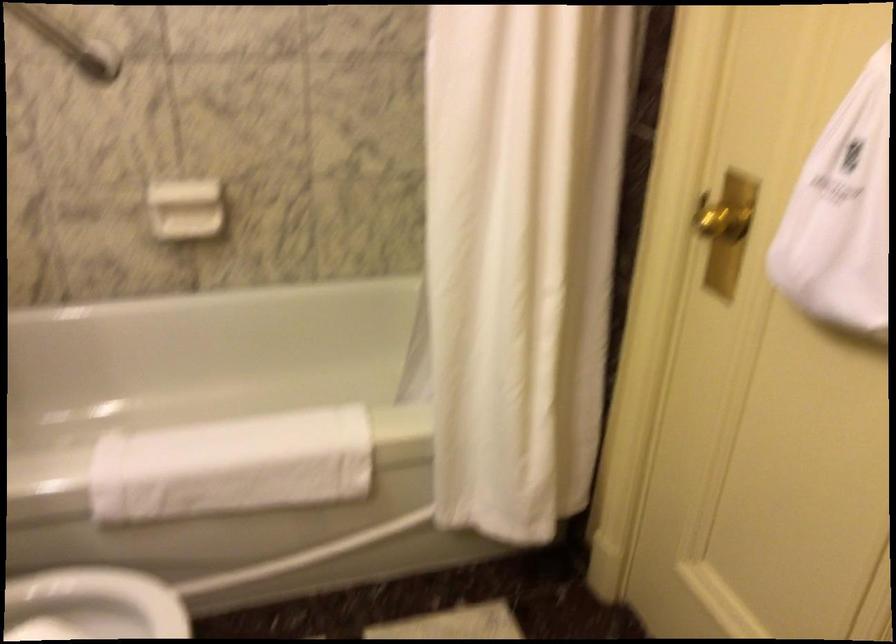
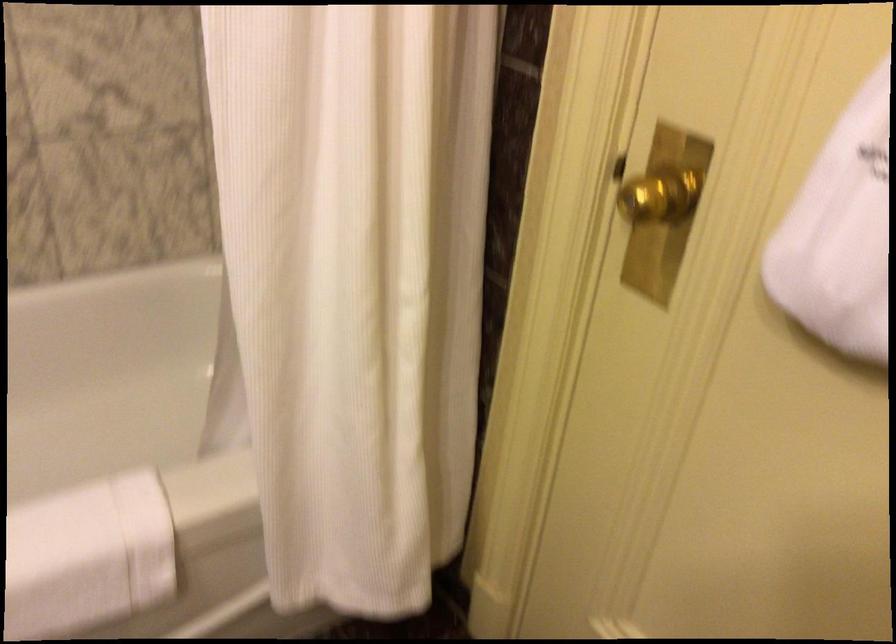
Question: The images are taken continuously from a first-person perspective. In which direction is your viewpoint rotating?

Choices:
 (A) Left
 (B) Right
 (C) Up
 (D) Down

Answer: (B)